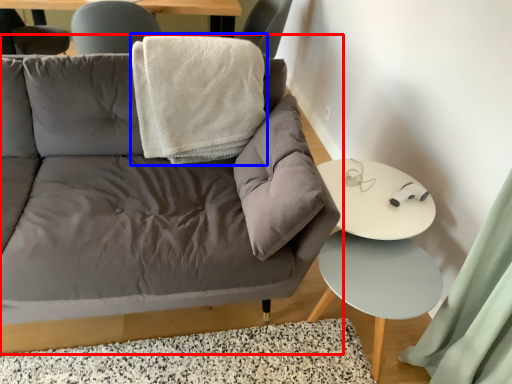
Question: Which object is further to the camera taking this photo, studio couch (highlighted by a red box) or blanket (highlighted by a blue box)?

Choices:
 (A) studio couch
 (B) blanket

Answer: (B)